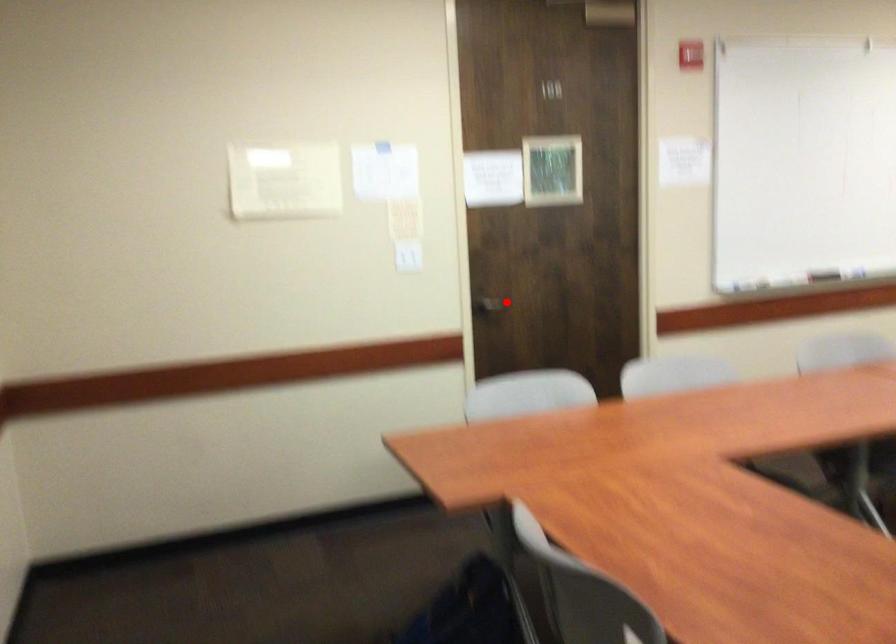
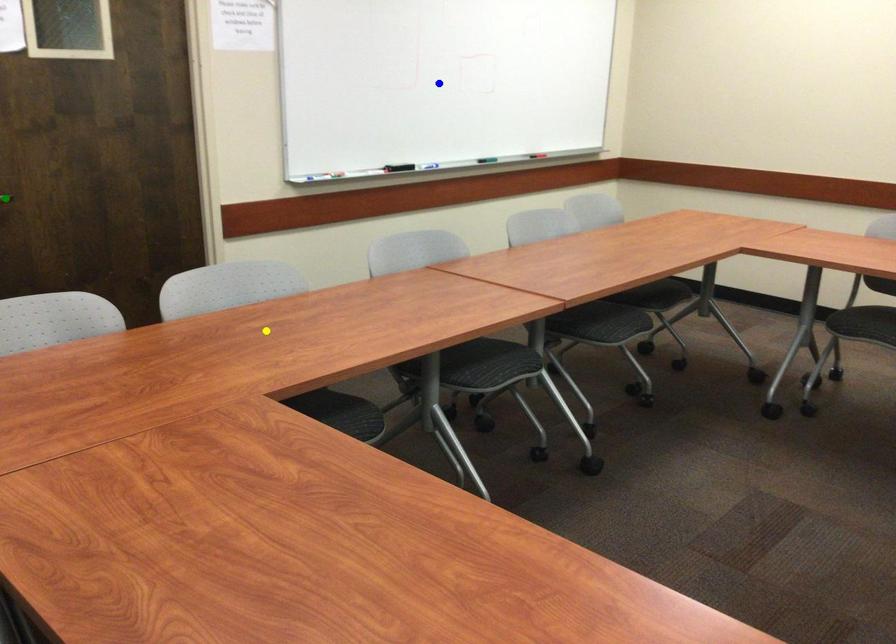
Question: I am providing you with two images of the same scene from different viewpoints. A red point is marked on the first image. You are given multiple points on the second image. In image 2, which mark is for the same physical point as the one in image 1?

Choices:
 (A) blue point
 (B) green point
 (C) yellow point

Answer: (B)